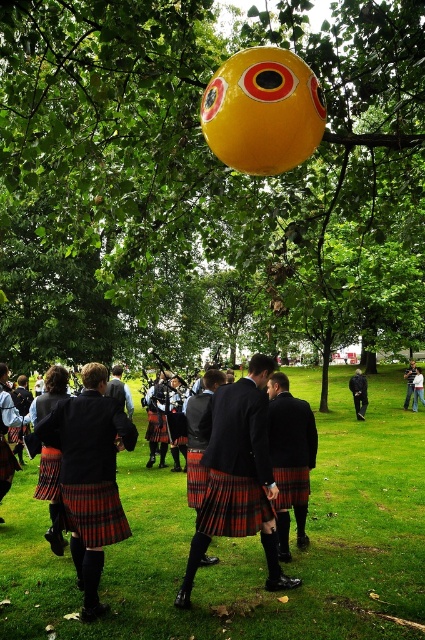
Can you confirm if plaid kilt at center is taller than light blue denim jacket at center?

Yes, plaid kilt at center is taller than light blue denim jacket at center.

Measure the distance between point (91, 397) and camera.

The distance of point (91, 397) from camera is 4.44 meters.

The image size is (425, 640). Identify the location of plaid kilt at center. (90, 476).

From the picture: Can you confirm if green grass at center is positioned to the left of red plaid kilt at center?

Incorrect, green grass at center is not on the left side of red plaid kilt at center.

Who is more distant from viewer, (365, 618) or (221, 436)?

The point (221, 436) is behind.

Is point (323, 541) closer to camera compared to point (289, 582)?

No, (323, 541) is behind (289, 582).

Where is `green grass at center`? green grass at center is located at coordinates (248, 544).

Is green grass at center above light blue denim jacket at center?

Incorrect, green grass at center is not positioned above light blue denim jacket at center.

Does green grass at center appear under light blue denim jacket at center?

Yes.

I want to click on green grass at center, so click(248, 544).